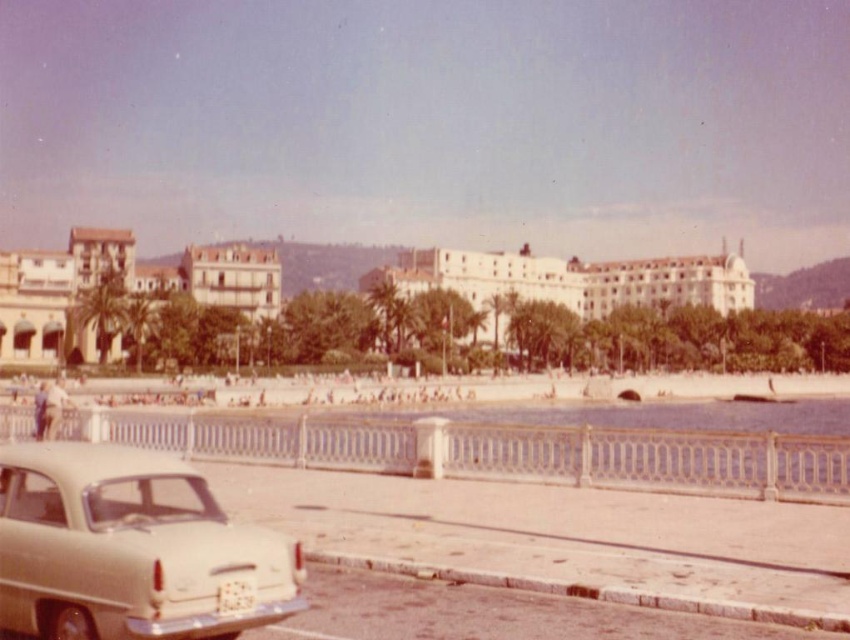
Consider the image. You are standing at the center of the image and want to take a photo of the beige matte car at lower left. In which direction should you move to get a clear view of it?

The beige matte car at lower left is located at point (x=131, y=548), so you should move to the lower left direction to get a clear view of it.

Consider the image. You are a tourist standing at the scenic coastal view and want to take a photo of the beige matte car at lower left and the white textured building at center. Which object should you focus on first if you want to capture both in the same frame without moving your camera?

You should focus on the beige matte car at lower left first because it is closer to you than the white textured building at center, so adjusting focus from near to far will help include both in the frame.